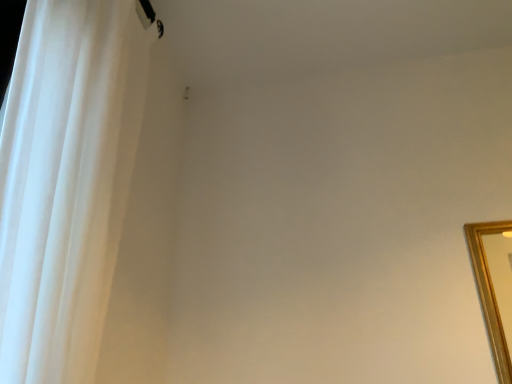
Measure the distance between white sheer curtain at left and camera.

They are 21.57 inches apart.

Describe the element at coordinates (66, 182) in the screenshot. The height and width of the screenshot is (384, 512). I see `white sheer curtain at left` at that location.

Where is `white sheer curtain at left`? Image resolution: width=512 pixels, height=384 pixels. white sheer curtain at left is located at coordinates (66, 182).

Locate an element on the screen. This screenshot has height=384, width=512. white sheer curtain at left is located at coordinates (66, 182).